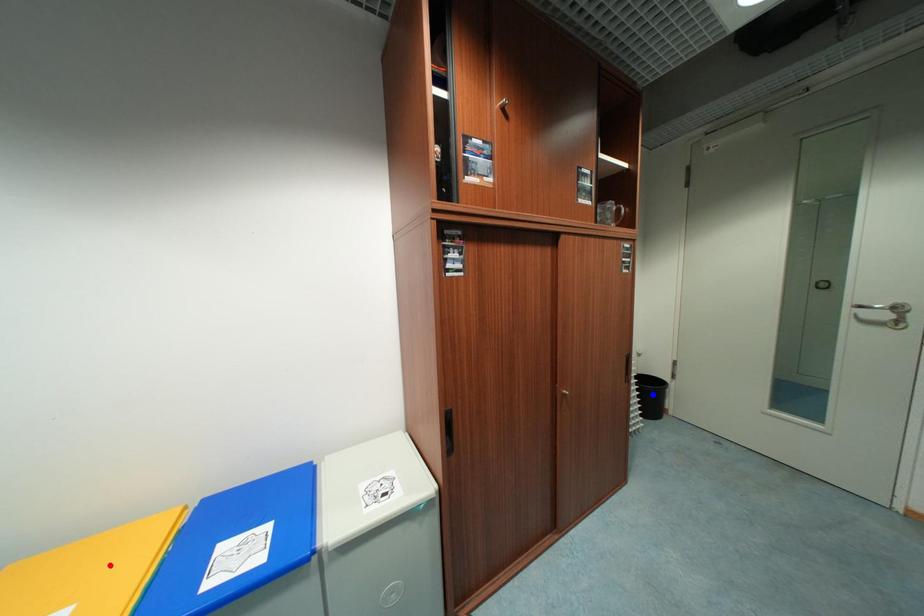
Question: Which of the two points in the image is closer to the camera?

Choices:
 (A) Blue point is closer.
 (B) Red point is closer.

Answer: (B)